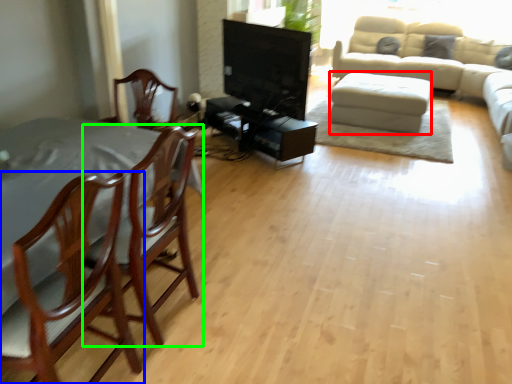
Question: Estimate the real-world distances between objects in this image. Which object is closer to footrest (highlighted by a red box), chair (highlighted by a blue box) or chair (highlighted by a green box)?

Choices:
 (A) chair
 (B) chair

Answer: (B)